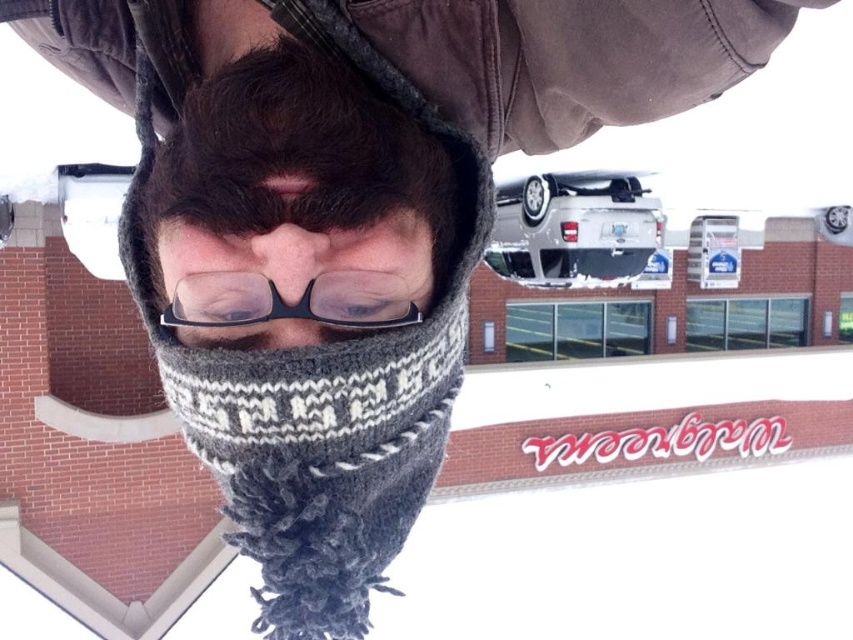
Question: Which object is positioned farthest from the clear plastic glasses at center?

Choices:
 (A) knitted wool scarf at center
 (B) black plastic glasses at center

Answer: (A)

Question: Can you confirm if knitted gray scarf at center is wider than black plastic glasses at center?

Choices:
 (A) yes
 (B) no

Answer: (A)

Question: Which of the following is the farthest from the observer?

Choices:
 (A) black plastic glasses at center
 (B) clear plastic glasses at center
 (C) knitted gray scarf at center
 (D) knitted wool scarf at center

Answer: (A)

Question: Does knitted gray scarf at center have a lesser width compared to black plastic glasses at center?

Choices:
 (A) no
 (B) yes

Answer: (A)

Question: Can you confirm if knitted wool scarf at center is positioned below black plastic glasses at center?

Choices:
 (A) yes
 (B) no

Answer: (B)

Question: Considering the real-world distances, which object is closest to the knitted gray scarf at center?

Choices:
 (A) black plastic glasses at center
 (B) knitted wool scarf at center

Answer: (B)